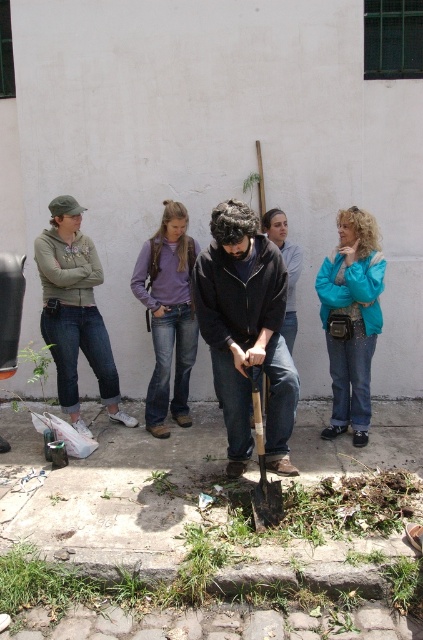
You are standing in the scene and want to place a small flag exactly between the two points, point (257,388) and point (422,564). Which point is closer to you when you are placing the flag?

Point (422,564) is closer to you because it is nearer to the camera than point (257,388).

You are a gardener who needs to determine which object is taller between the wooden shovel at center and the green leafy plant at lower center. Based on the scene, which one is taller?

The wooden shovel at center is taller than the green leafy plant at lower center according to the description.